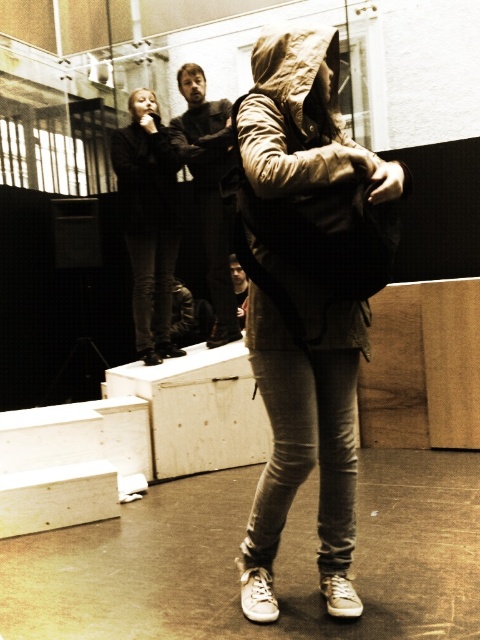
Question: Is dark brown leather jacket at center wider than dark gray hoodie at upper left?

Choices:
 (A) yes
 (B) no

Answer: (A)

Question: Can you confirm if black leather jacket at upper left is smaller than dark gray hoodie at upper left?

Choices:
 (A) no
 (B) yes

Answer: (A)

Question: Among these points, which one is farthest from the camera?

Choices:
 (A) (144, 216)
 (B) (227, 212)
 (C) (252, 177)
 (D) (158, 321)

Answer: (D)

Question: Among these objects, which one is nearest to the camera?

Choices:
 (A) dark brown leather jacket at center
 (B) black leather jacket at upper left
 (C) matte brown jacket at center
 (D) dark gray hoodie at upper left

Answer: (C)

Question: Which point is farther to the camera?

Choices:
 (A) (220, 257)
 (B) (348, 264)

Answer: (A)

Question: Is matte brown jacket at center bigger than dark gray hoodie at upper left?

Choices:
 (A) no
 (B) yes

Answer: (B)